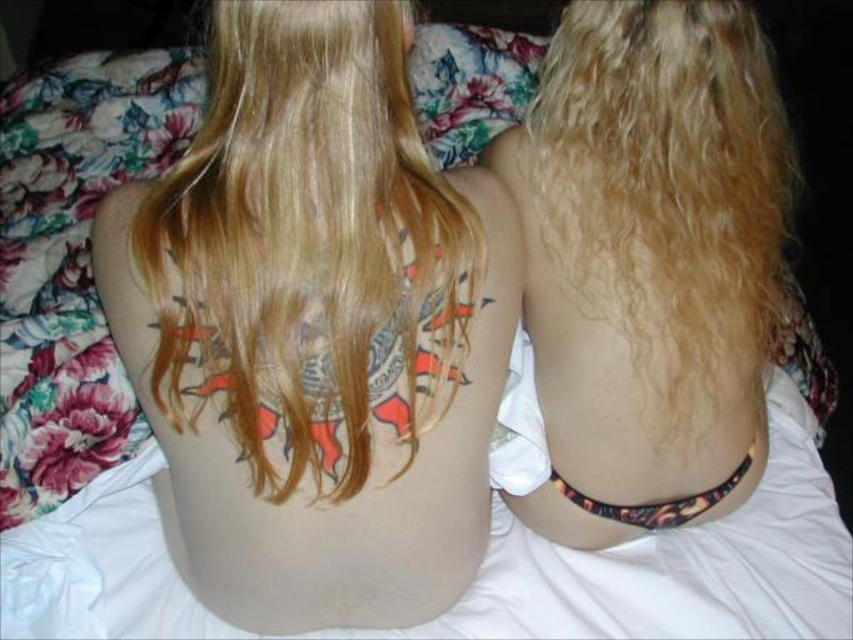
Is point (225, 35) closer to viewer compared to point (759, 161)?

Yes, point (225, 35) is closer to viewer.

Which is more to the left, blonde hair at upper left or curly blonde hair at center?

blonde hair at upper left is more to the left.

Describe the element at coordinates (308, 246) in the screenshot. I see `blonde hair at upper left` at that location.

Find the location of a particular element. blonde hair at upper left is located at coordinates (308, 246).

Can you confirm if curly blonde hair at center is taller than multicolored ink tattoo at lower center?

Correct, curly blonde hair at center is much taller as multicolored ink tattoo at lower center.

This screenshot has height=640, width=853. Describe the element at coordinates (668, 180) in the screenshot. I see `curly blonde hair at center` at that location.

Find the location of a particular element. The image size is (853, 640). curly blonde hair at center is located at coordinates (668, 180).

Is blonde hair at upper left to the left of multicolored ink tattoo at lower center from the viewer's perspective?

Correct, you'll find blonde hair at upper left to the left of multicolored ink tattoo at lower center.

Is point (357, 115) positioned after point (694, 508)?

No, it is not.

The image size is (853, 640). Find the location of `blonde hair at upper left`. blonde hair at upper left is located at coordinates (308, 246).